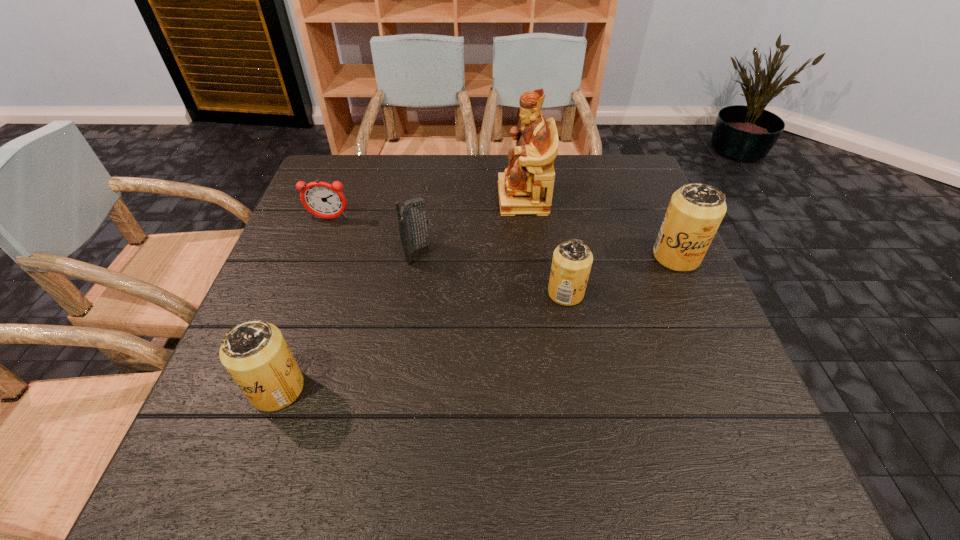
If equal spacing is desired by inserting an extra beer_can among them, please point out a free spot for this new beer_can. Please provide its 2D coordinates. Your answer should be formatted as a tuple, i.e. [(x, y)], where the tuple contains the x and y coordinates of a point satisfying the conditions above.

[(435, 336)]